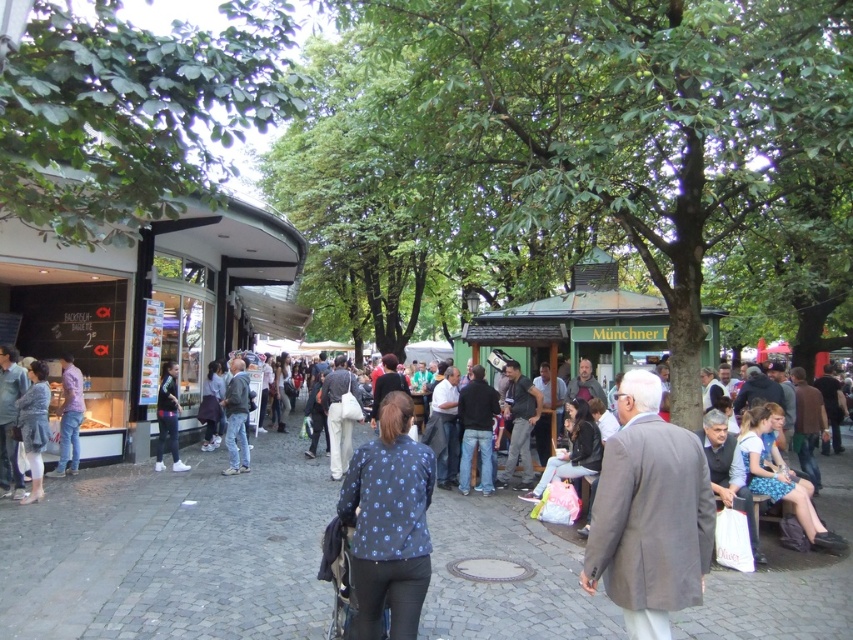
Question: Is denim jeans at center smaller than dark blue jeans at left?

Choices:
 (A) yes
 (B) no

Answer: (B)

Question: Is paved stone pavement at center above gray wool coat at center?

Choices:
 (A) no
 (B) yes

Answer: (A)

Question: Which object is closer to the camera taking this photo?

Choices:
 (A) light purple shirt at left
 (B) dark blue jeans at left
 (C) gray wool coat at center
 (D) blue dotted jacket at center

Answer: (C)

Question: Can you confirm if denim jacket at lower left is positioned to the right of denim jeans at center?

Choices:
 (A) yes
 (B) no

Answer: (B)

Question: Which point is closer to the camera?

Choices:
 (A) blue denim dress at lower right
 (B) gray wool coat at center
 (C) light purple shirt at left
 (D) denim jacket at lower left

Answer: (B)

Question: Among these points, which one is farthest from the camera?

Choices:
 (A) (804, 506)
 (B) (270, 570)
 (C) (20, 433)
 (D) (663, 596)

Answer: (C)